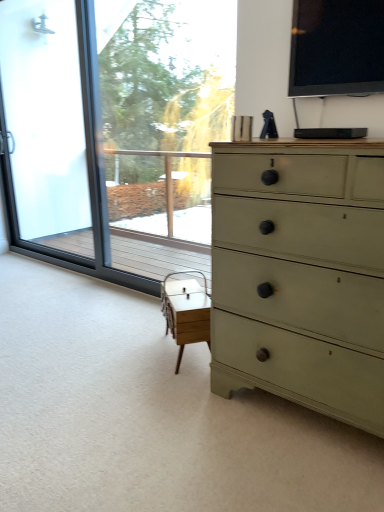
Identify the location of vacant region in front of white wood table at center. (175, 381).